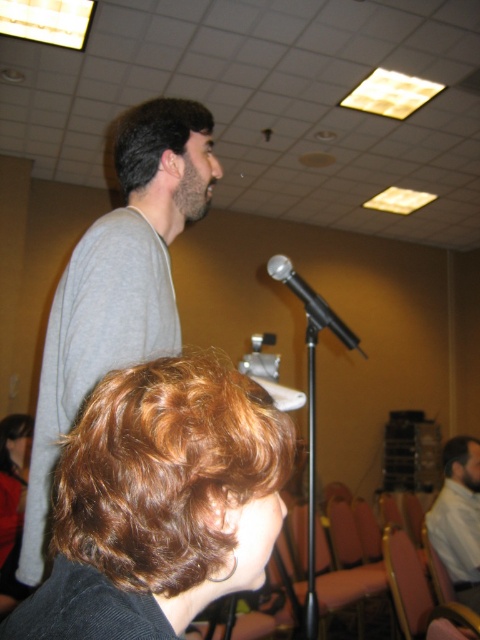
You are a photographer setting up a camera in the conference room. You want to ensure both the brown curly hair at upper left and the dark brown curly hair at upper center are in focus. Which hair should you adjust the focus for first to ensure proper depth of field?

The brown curly hair at upper left is taller than the dark brown curly hair at upper center, so you should focus on the brown curly hair at upper left first to ensure proper depth of field.

What is located at the point with coordinates (x=312, y=301) in the image?

The silver metallic microphone at center is located at the point with coordinates (x=312, y=301) in the image.